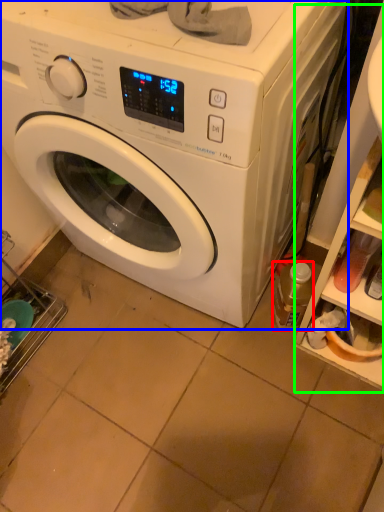
Question: Which object is positioned closest to bottle (highlighted by a red box)? Select from washing machine (highlighted by a blue box) and shelf (highlighted by a green box).

Choices:
 (A) washing machine
 (B) shelf

Answer: (B)